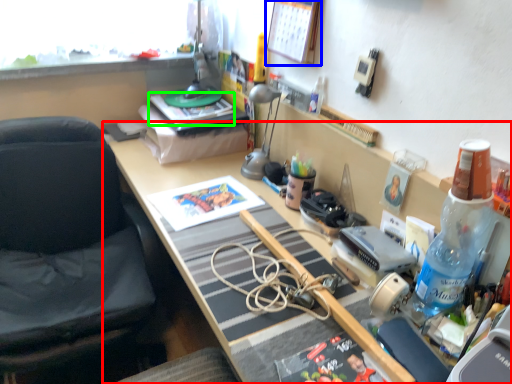
Question: Based on their relative distances, which object is farther from desk (highlighted by a red box)? Choose from picture frame (highlighted by a blue box) and book (highlighted by a green box).

Choices:
 (A) picture frame
 (B) book

Answer: (A)